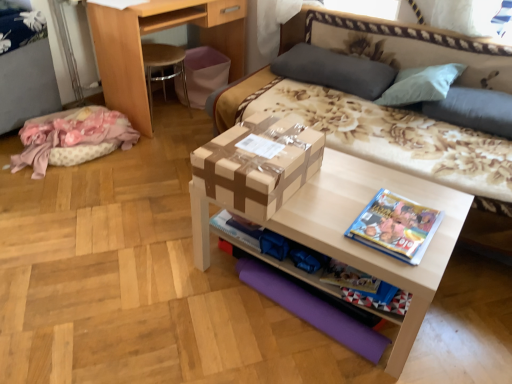
Question: Does gray fabric pillow at upper center, acting as the 2th pillow starting from the right, lie behind matte cardboard box at center?

Choices:
 (A) no
 (B) yes

Answer: (B)

Question: Does gray fabric pillow at upper center, acting as the 2th pillow starting from the right, have a lesser height compared to matte cardboard box at center?

Choices:
 (A) no
 (B) yes

Answer: (B)

Question: Can you confirm if gray fabric pillow at upper center, acting as the 2th pillow starting from the right, is positioned to the right of matte cardboard box at center?

Choices:
 (A) yes
 (B) no

Answer: (A)

Question: Considering the relative sizes of gray fabric pillow at upper center, acting as the 2th pillow starting from the right, and matte cardboard box at center in the image provided, is gray fabric pillow at upper center, acting as the 2th pillow starting from the right, wider than matte cardboard box at center?

Choices:
 (A) no
 (B) yes

Answer: (A)

Question: Is matte cardboard box at center inside gray fabric pillow at upper center, which is the 1th pillow from left to right?

Choices:
 (A) no
 (B) yes

Answer: (A)

Question: In the image, is light brown wood desk at upper left positioned in front of or behind floral fabric studio couch at center?

Choices:
 (A) behind
 (B) front

Answer: (A)

Question: From a real-world perspective, is light brown wood desk at upper left positioned above or below floral fabric studio couch at center?

Choices:
 (A) below
 (B) above

Answer: (A)

Question: In terms of width, does light brown wood desk at upper left look wider or thinner when compared to floral fabric studio couch at center?

Choices:
 (A) thin
 (B) wide

Answer: (A)

Question: Is light brown wood desk at upper left inside or outside of floral fabric studio couch at center?

Choices:
 (A) inside
 (B) outside

Answer: (B)

Question: In terms of width, does gray fabric pillow at upper center, acting as the 2th pillow starting from the right, look wider or thinner when compared to brown cardboard box at center?

Choices:
 (A) wide
 (B) thin

Answer: (B)

Question: From a real-world perspective, relative to brown cardboard box at center, is gray fabric pillow at upper center, which is the 1th pillow from left to right, vertically above or below?

Choices:
 (A) above
 (B) below

Answer: (B)

Question: In the image, is gray fabric pillow at upper center, which is the 1th pillow from left to right, positioned in front of or behind brown cardboard box at center?

Choices:
 (A) front
 (B) behind

Answer: (B)

Question: Is point (343, 62) closer or farther from the camera than point (275, 127)?

Choices:
 (A) farther
 (B) closer

Answer: (A)

Question: Considering the positions of brown cardboard box at center and blue glossy book at right in the image, is brown cardboard box at center bigger or smaller than blue glossy book at right?

Choices:
 (A) small
 (B) big

Answer: (B)

Question: Is brown cardboard box at center situated inside blue glossy book at right or outside?

Choices:
 (A) outside
 (B) inside

Answer: (A)